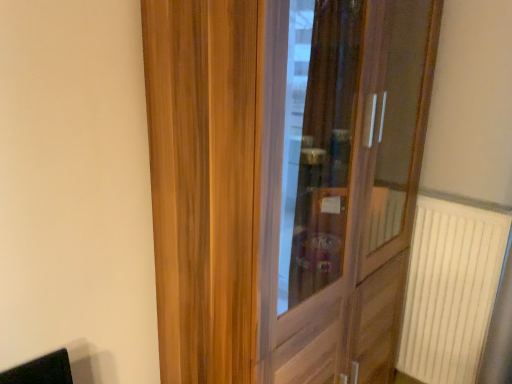
The image size is (512, 384). Describe the element at coordinates (280, 188) in the screenshot. I see `wooden door at center` at that location.

I want to click on wooden door at center, so click(x=280, y=188).

This screenshot has height=384, width=512. What do you see at coordinates (452, 286) in the screenshot?
I see `white plastic radiator at right` at bounding box center [452, 286].

At what (x,y) coordinates should I click in order to perform the action: click on white plastic radiator at right. Please return your answer as a coordinate pair (x, y). Image resolution: width=512 pixels, height=384 pixels. Looking at the image, I should click on (452, 286).

Locate an element on the screen. wooden door at center is located at coordinates (280, 188).

Considering the relative positions of wooden door at center and white plastic radiator at right in the image provided, is wooden door at center to the left or to the right of white plastic radiator at right?

wooden door at center is positioned on white plastic radiator at right's left side.

Is wooden door at center in front of or behind white plastic radiator at right in the image?

In the image, wooden door at center appears in front of white plastic radiator at right.

Does point (216, 250) appear closer or farther from the camera than point (486, 211)?

Point (216, 250) is positioned closer to the camera compared to point (486, 211).

From the image's perspective, is wooden door at center above or below white plastic radiator at right?

Based on their image positions, wooden door at center is located above white plastic radiator at right.

From a real-world perspective, which object rests below the other?

white plastic radiator at right.

Between wooden door at center and white plastic radiator at right, which one has larger width?

wooden door at center is wider.

Considering the sizes of objects wooden door at center and white plastic radiator at right in the image provided, who is shorter, wooden door at center or white plastic radiator at right?

white plastic radiator at right.

Is wooden door at center bigger than white plastic radiator at right?

Indeed, wooden door at center has a larger size compared to white plastic radiator at right.

Looking at this image, is wooden door at center situated inside white plastic radiator at right or outside?

wooden door at center is located beyond the bounds of white plastic radiator at right.

Looking at this image, is wooden door at center next to white plastic radiator at right?

No, wooden door at center is not making contact with white plastic radiator at right.

Could you tell me if wooden door at center is turned towards white plastic radiator at right?

No, wooden door at center does not turn towards white plastic radiator at right.

Measure the distance from wooden door at center to white plastic radiator at right.

The distance of wooden door at center from white plastic radiator at right is 54.22 centimeters.

In order to click on door in front of the white plastic radiator at right in this screenshot , I will do `click(280, 188)`.

Is white plastic radiator at right at the right side of wooden door at center?

Yes.

From the picture: Does white plastic radiator at right come in front of wooden door at center?

No.

Which is closer, (508,207) or (397,329)?

Point (508,207).

From the image's perspective, is white plastic radiator at right positioned above or below wooden door at center?

white plastic radiator at right is below wooden door at center.

From a real-world perspective, is white plastic radiator at right under wooden door at center?

Yes.

Looking at this image, between white plastic radiator at right and wooden door at center, which one has smaller width?

With smaller width is white plastic radiator at right.

Considering the relative sizes of white plastic radiator at right and wooden door at center in the image provided, is white plastic radiator at right shorter than wooden door at center?

Yes.

Is white plastic radiator at right bigger than wooden door at center?

Actually, white plastic radiator at right might be smaller than wooden door at center.

Is white plastic radiator at right completely or partially outside of wooden door at center?

Yes.

Is white plastic radiator at right next to wooden door at center?

white plastic radiator at right and wooden door at center are not in contact.

Is wooden door at center at the back of white plastic radiator at right?

No, white plastic radiator at right is not facing the opposite direction of wooden door at center.

How many degrees apart are the facing directions of white plastic radiator at right and wooden door at center?

The angle between the facing direction of white plastic radiator at right and the facing direction of wooden door at center is 91.3 degrees.

Locate an element on the screen. Image resolution: width=512 pixels, height=384 pixels. door above the white plastic radiator at right (from the image's perspective) is located at coordinates (280, 188).

Locate an element on the screen. Image resolution: width=512 pixels, height=384 pixels. door located above the white plastic radiator at right (from the image's perspective) is located at coordinates (280, 188).

The image size is (512, 384). What are the coordinates of `radiator below the wooden door at center (from a real-world perspective)` in the screenshot? It's located at (452, 286).